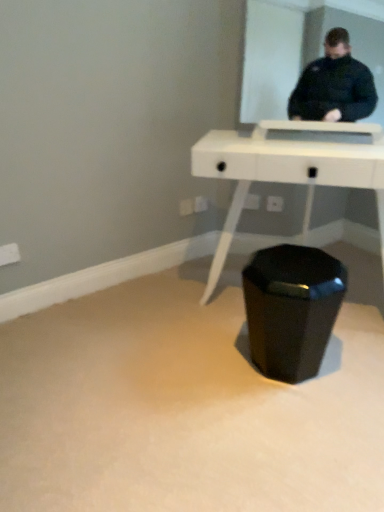
You are a GUI agent. You are given a task and a screenshot of the screen. Output one action in this format:
    pyautogui.click(x=<x>, y=<y>)
    Task: Click on the black glossy waste container at center
    This screenshot has height=512, width=384.
    Given the screenshot: What is the action you would take?
    pyautogui.click(x=291, y=309)

Describe the element at coordinates (291, 309) in the screenshot. I see `black glossy waste container at center` at that location.

Where is `white glossy table at center`? white glossy table at center is located at coordinates (290, 167).

This screenshot has width=384, height=512. What do you see at coordinates (290, 167) in the screenshot?
I see `white glossy table at center` at bounding box center [290, 167].

In order to click on black glossy waste container at center in this screenshot , I will do [x=291, y=309].

Considering the positions of objects white glossy table at center and black glossy waste container at center in the image provided, who is more to the left, white glossy table at center or black glossy waste container at center?

black glossy waste container at center.

Who is more distant, white glossy table at center or black glossy waste container at center?

black glossy waste container at center is behind.

Does point (245, 169) appear closer or farther from the camera than point (271, 357)?

Point (245, 169) appears to be closer to the viewer than point (271, 357).

From the image's perspective, is white glossy table at center positioned above or below black glossy waste container at center?

white glossy table at center is above black glossy waste container at center.

From a real-world perspective, which is physically below, white glossy table at center or black glossy waste container at center?

In real-world perspective, black glossy waste container at center is lower.

Is white glossy table at center wider or thinner than black glossy waste container at center?

white glossy table at center is wider than black glossy waste container at center.

Considering the relative sizes of white glossy table at center and black glossy waste container at center in the image provided, is white glossy table at center taller than black glossy waste container at center?

Yes.

Between white glossy table at center and black glossy waste container at center, which one has larger size?

white glossy table at center is bigger.

Is white glossy table at center located outside black glossy waste container at center?

Absolutely, white glossy table at center is external to black glossy waste container at center.

Would you say white glossy table at center is a long distance from black glossy waste container at center?

No, there isn't a large distance between white glossy table at center and black glossy waste container at center.

Is white glossy table at center aimed at black glossy waste container at center?

Yes, white glossy table at center is oriented towards black glossy waste container at center.

Can you tell me how much white glossy table at center and black glossy waste container at center differ in facing direction?

They differ by 173 degrees in their facing directions.

Where is `waste container that is on the left side of white glossy table at center`? This screenshot has width=384, height=512. waste container that is on the left side of white glossy table at center is located at coordinates (291, 309).

Between black glossy waste container at center and white glossy table at center, which one appears on the left side from the viewer's perspective?

black glossy waste container at center.

Which is in front, black glossy waste container at center or white glossy table at center?

white glossy table at center.

Considering the positions of point (314, 333) and point (372, 127), is point (314, 333) closer or farther from the camera than point (372, 127)?

Point (314, 333).

From the image's perspective, does black glossy waste container at center appear lower than white glossy table at center?

Indeed, from the image's perspective, black glossy waste container at center is shown beneath white glossy table at center.

From a real-world perspective, between black glossy waste container at center and white glossy table at center, who is vertically lower?

black glossy waste container at center, from a real-world perspective.

Consider the image. Is black glossy waste container at center wider or thinner than white glossy table at center?

Considering their sizes, black glossy waste container at center looks slimmer than white glossy table at center.

From their relative heights in the image, would you say black glossy waste container at center is taller or shorter than white glossy table at center?

Considering their sizes, black glossy waste container at center has less height than white glossy table at center.

Considering the relative sizes of black glossy waste container at center and white glossy table at center in the image provided, is black glossy waste container at center bigger than white glossy table at center?

No, black glossy waste container at center is not bigger than white glossy table at center.

Can white glossy table at center be found inside black glossy waste container at center?

Definitely not — white glossy table at center is not inside black glossy waste container at center.

Is black glossy waste container at center touching white glossy table at center?

black glossy waste container at center is not next to white glossy table at center, and they're not touching.

Is black glossy waste container at center positioned with its back to white glossy table at center?

black glossy waste container at center does not have its back to white glossy table at center.

Can you tell me how much black glossy waste container at center and white glossy table at center differ in facing direction?

The facing directions of black glossy waste container at center and white glossy table at center are 173 degrees apart.

The image size is (384, 512). Find the location of `table located on the right of black glossy waste container at center`. table located on the right of black glossy waste container at center is located at coordinates (290, 167).

At what (x,y) coordinates should I click in order to perform the action: click on waste container that is under the white glossy table at center (from a real-world perspective). Please return your answer as a coordinate pair (x, y). The height and width of the screenshot is (512, 384). Looking at the image, I should click on (291, 309).

What are the coordinates of `table above the black glossy waste container at center (from the image's perspective)` in the screenshot? It's located at (290, 167).